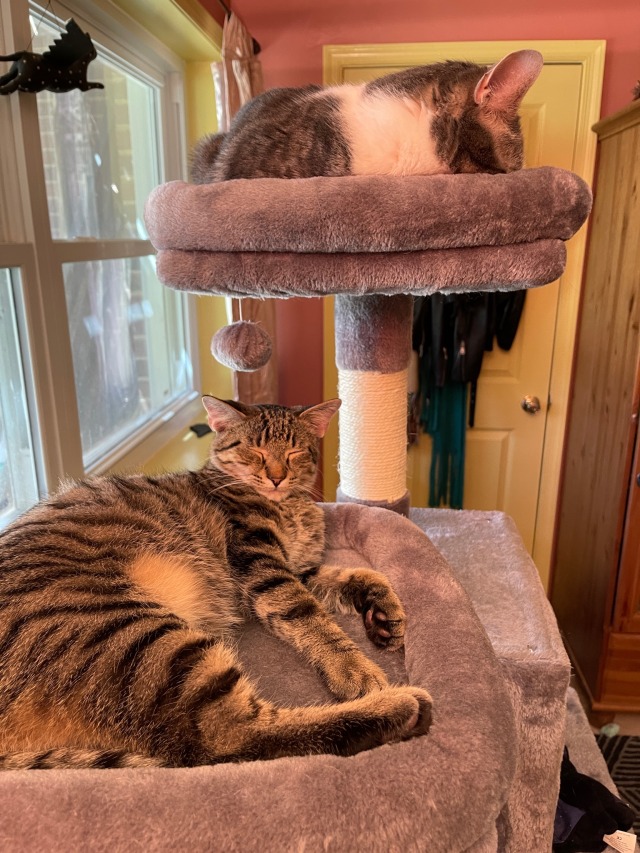
The height and width of the screenshot is (853, 640). In order to click on door knob in this screenshot , I will do `click(534, 409)`.